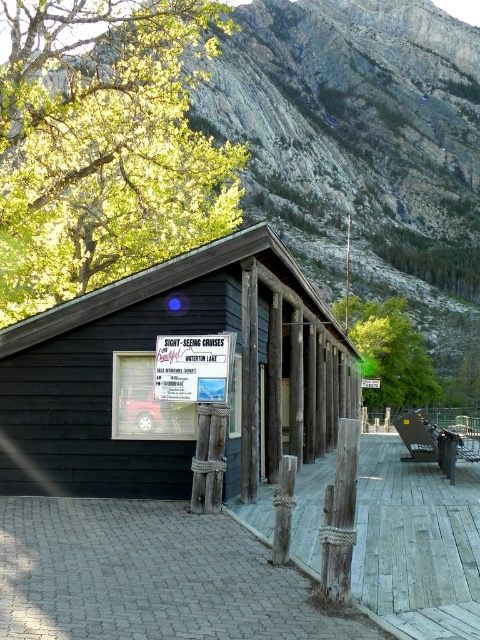
From the picture: You are standing at the base of the rugged stone mountain at upper center and want to reach the rustic wooden building. Given that the average walking speed is 3 miles per hour, how many minutes would it take to walk to the building?

The rugged stone mountain at upper center is 406.51 feet away from the viewer. Converting feet to miles, 406.51 feet is approximately 0.077 miles. At a walking speed of 3 miles per hour, it would take roughly 0.077 divided by 3 equals 0.0257 hours, which is about 1.54 minutes. So, it would take approximately 1.5 minutes to walk to the building.

You are a hiker who wants to take a photo of the rugged stone mountain at upper center and the green leafy tree at upper left. Which object should you focus on first if you want to capture both in a single frame without moving the camera?

You should focus on the rugged stone mountain at upper center first because it is taller than the green leafy tree at upper left, so adjusting the camera angle to include its height will naturally include the shorter tree in the frame.